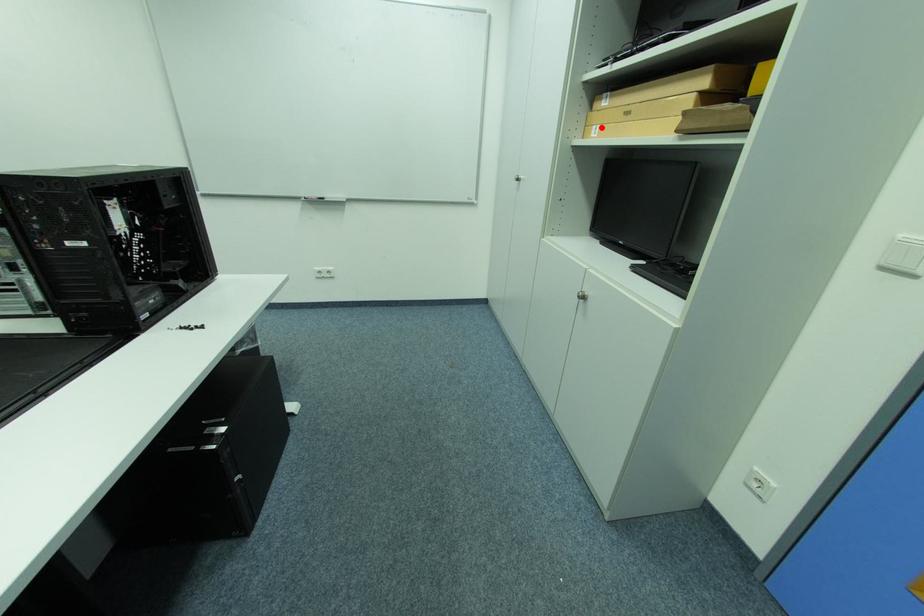
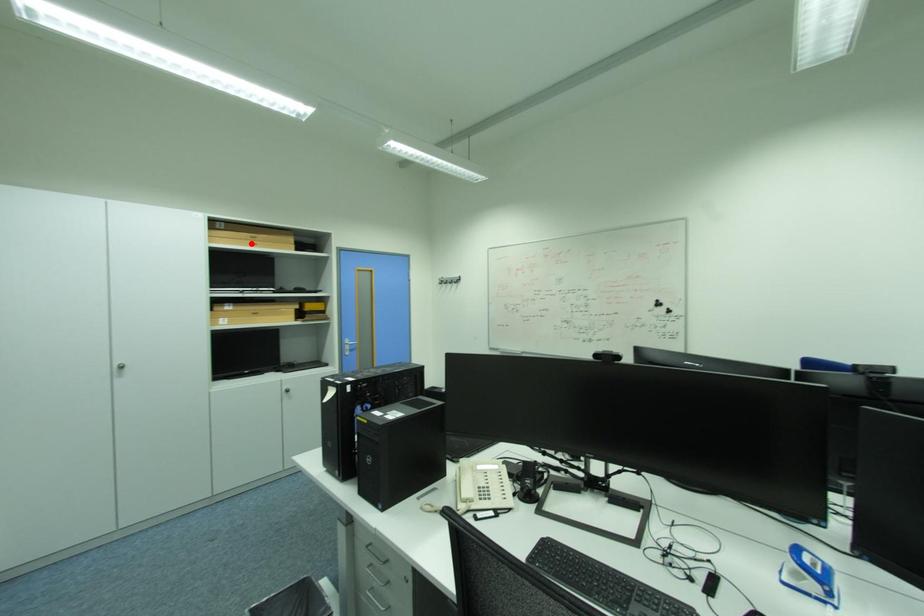
I am providing you with two images of the same scene from different viewpoints. A red point is marked on the first image and another point is marked on the second image. Do the highlighted points in image1 and image2 indicate the same real-world spot?

No